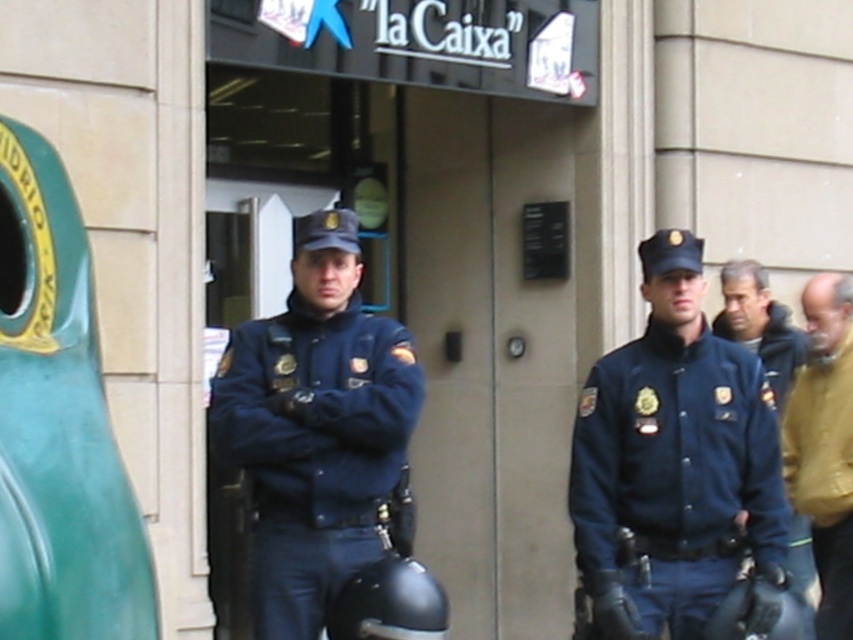
You are a photographer trying to capture both the matte blue uniform at center and the brown leather jacket at right in a single frame. Given that your camera has a maximum focus range of 2 meters, will you be able to include both subjects in the photo without moving the camera?

The matte blue uniform at center and the brown leather jacket at right are 2.29 meters apart from each other. Since the distance between them exceeds the camera s maximum focus range of 2 meters, you will not be able to include both subjects in the photo without moving the camera.

You are a tailor who needs to determine which item requires more fabric to make between the brown leather jacket at right and the dark blue uniform at center. Based on the image, which one would need more fabric?

The brown leather jacket at right is bigger than the dark blue uniform at center, so it would require more fabric to make.